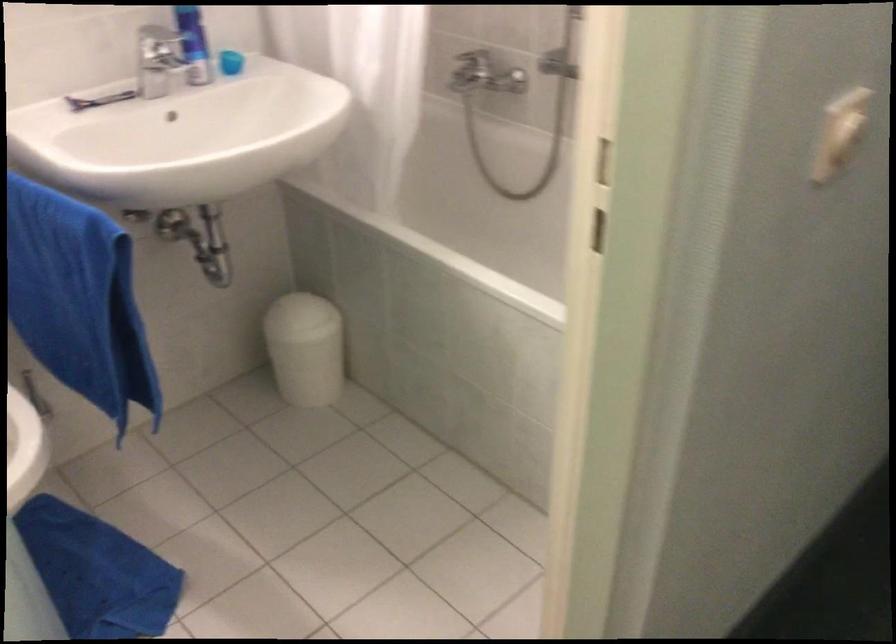
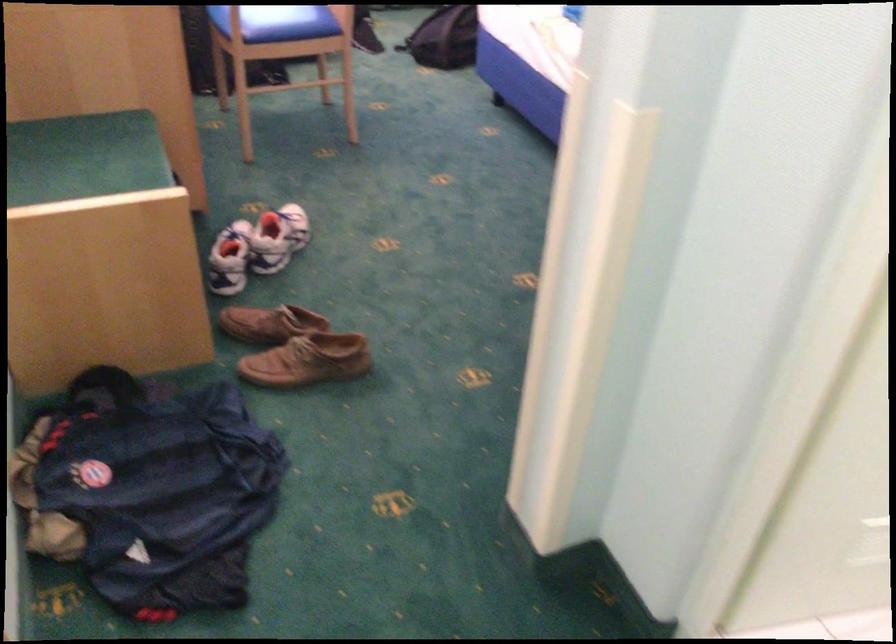
How did the camera likely rotate?

The camera's rotation is toward left-down.